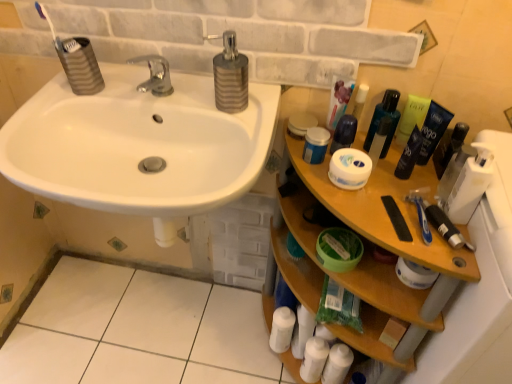
Where is `unoccupied area in front of translucent plastic bottle at right, which is counted as the 7th mouthwash, starting from the left`? The width and height of the screenshot is (512, 384). unoccupied area in front of translucent plastic bottle at right, which is counted as the 7th mouthwash, starting from the left is located at coordinates (424, 227).